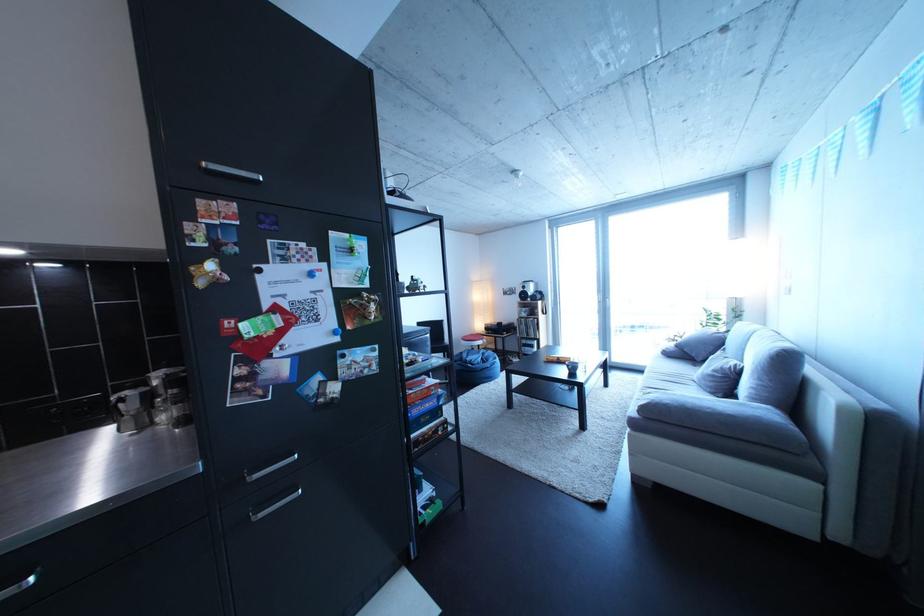
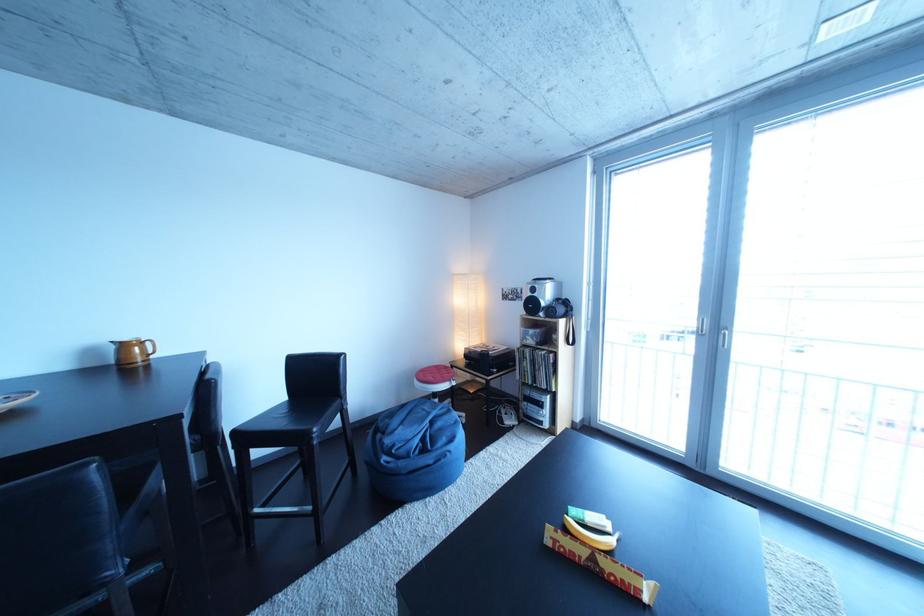
Locate, in the second image, the point that corresponds to (x=537, y=293) in the first image.

(545, 296)